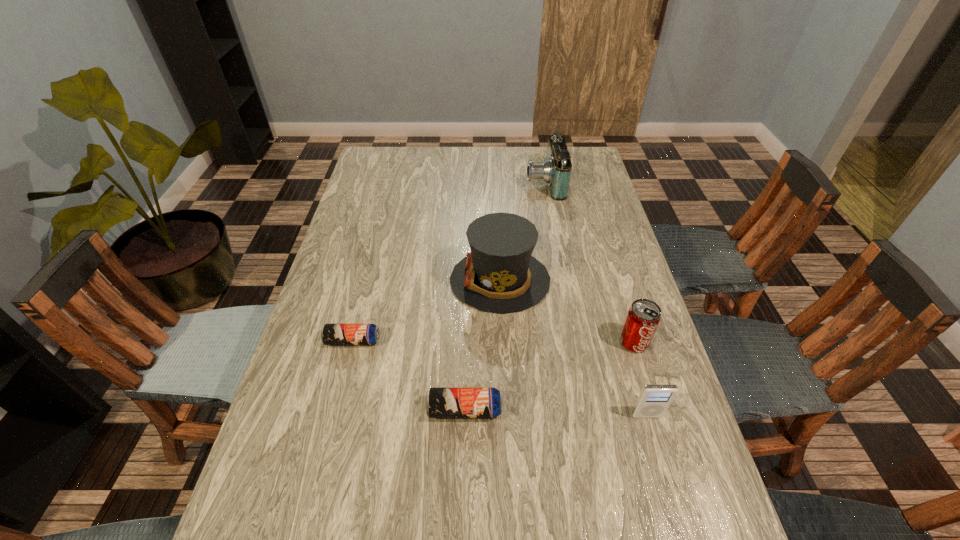
Where is `object that is positioned at the left edge`? object that is positioned at the left edge is located at coordinates (331, 334).

The image size is (960, 540). I want to click on pop soda located in the right edge section of the desktop, so click(x=643, y=317).

Where is `camcorder situated at the right edge`? Image resolution: width=960 pixels, height=540 pixels. camcorder situated at the right edge is located at coordinates (555, 170).

Locate an element on the screen. iPod situated at the right edge is located at coordinates (654, 400).

Identify the location of object that is at the far right corner. This screenshot has height=540, width=960. (555, 170).

Locate an element on the screen. The width and height of the screenshot is (960, 540). vacant space at the far edge is located at coordinates (427, 153).

Locate an element on the screen. The image size is (960, 540). vacant space at the near edge of the desktop is located at coordinates point(335,496).

You are a GUI agent. You are given a task and a screenshot of the screen. Output one action in this format:
    pyautogui.click(x=<x>, y=<y>)
    Task: Click on the vacant space at the left edge of the desktop
    Image resolution: width=960 pixels, height=540 pixels.
    Given the screenshot: What is the action you would take?
    pyautogui.click(x=353, y=210)

In the image, there is a desktop. Where is `vacant region at the right edge`? The height and width of the screenshot is (540, 960). vacant region at the right edge is located at coordinates (595, 205).

Find the location of `vacant space at the far left corner of the desktop`. vacant space at the far left corner of the desktop is located at coordinates (384, 156).